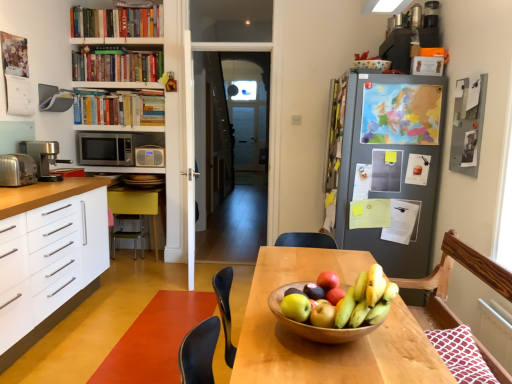
This screenshot has width=512, height=384. I want to click on vacant space situated above hardcover books at upper left, positioned as the second book in top-to-bottom order (from a real-world perspective), so click(x=116, y=41).